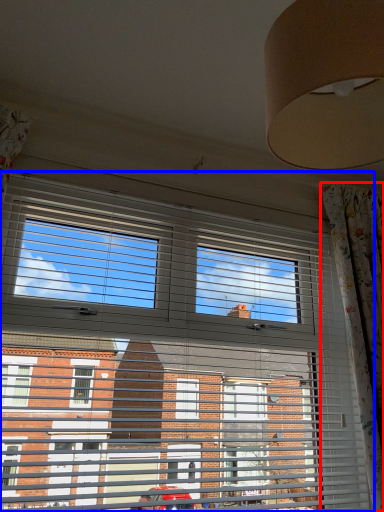
Question: Which object appears closest to the camera in this image, curtain (highlighted by a red box) or window (highlighted by a blue box)?

Choices:
 (A) curtain
 (B) window

Answer: (B)